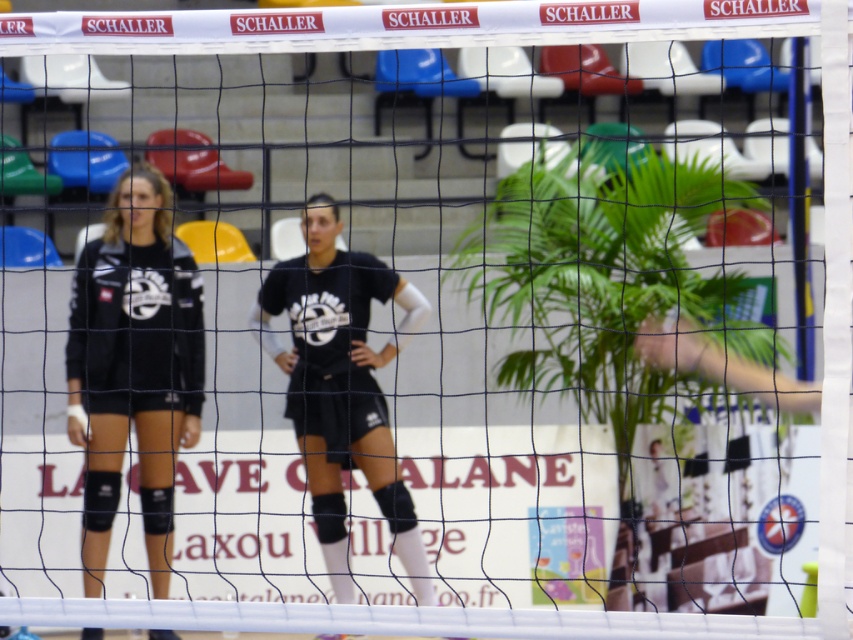
Question: Does black matte uniform at center have a smaller size compared to matte black uniform at center?

Choices:
 (A) no
 (B) yes

Answer: (B)

Question: Which object appears farthest from the camera in this image?

Choices:
 (A) black matte uniform at center
 (B) matte black uniform at center

Answer: (B)

Question: Which of the following is the farthest from the observer?

Choices:
 (A) (107, 339)
 (B) (285, 305)

Answer: (B)

Question: Is black matte uniform at center to the right of matte black uniform at center from the viewer's perspective?

Choices:
 (A) yes
 (B) no

Answer: (B)

Question: Can you confirm if black matte uniform at center is positioned below matte black uniform at center?

Choices:
 (A) no
 (B) yes

Answer: (A)